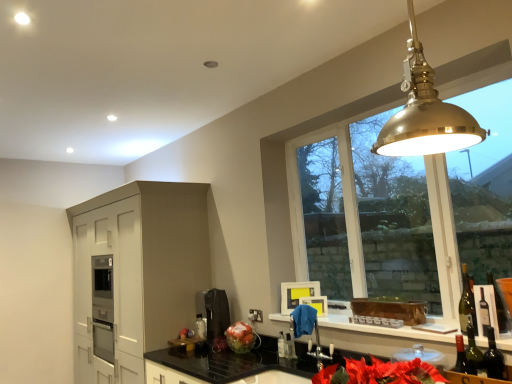
This screenshot has height=384, width=512. Describe the element at coordinates (499, 306) in the screenshot. I see `green glass wine bottle at right, the 2th wine bottle from the back` at that location.

Describe the element at coordinates (342, 179) in the screenshot. I see `clear glass window at upper right` at that location.

Locate an element on the screen. clear glass window at upper right is located at coordinates (342, 179).

The width and height of the screenshot is (512, 384). What are the coordinates of `translucent glass bottle at lower center` in the screenshot? It's located at (289, 346).

Image resolution: width=512 pixels, height=384 pixels. What do you see at coordinates (289, 346) in the screenshot? I see `translucent glass bottle at lower center` at bounding box center [289, 346].

The image size is (512, 384). Describe the element at coordinates (467, 303) in the screenshot. I see `green glass wine bottle at right, arranged as the 3th wine bottle when viewed from the front` at that location.

What is the approximate height of black granite countertop at lower center?

black granite countertop at lower center is 19.05 inches in height.

Image resolution: width=512 pixels, height=384 pixels. Find the location of `green glass wine bottle at right, the 2th wine bottle from the back`. green glass wine bottle at right, the 2th wine bottle from the back is located at coordinates (499, 306).

Between translucent glass bottle at lower center and green glass wine bottle at right, the 2th wine bottle from the back, which one has smaller width?

Thinner between the two is translucent glass bottle at lower center.

Is translucent glass bottle at lower center turned away from green glass wine bottle at right, the 2th wine bottle from the back?

No, green glass wine bottle at right, the 2th wine bottle from the back, is not at the back of translucent glass bottle at lower center.

Is green glass wine bottle at right, the 2th wine bottle from the back, inside translucent glass bottle at lower center?

No.

Which is behind, translucent glass bottle at lower center or green glass wine bottle at right, positioned as the 2th wine bottle in front-to-back order?

translucent glass bottle at lower center is further from the camera.

From the metallic silver faucet at lower center, count 3rd wine bottle to the right and point to it. Please provide its 2D coordinates.

[(499, 306)]

From the image's perspective, does metallic silver faucet at lower center appear lower than green glass wine bottle at right, positioned as the 2th wine bottle in front-to-back order?

Indeed, from the image's perspective, metallic silver faucet at lower center is shown beneath green glass wine bottle at right, positioned as the 2th wine bottle in front-to-back order.

Which of these two, metallic silver faucet at lower center or green glass wine bottle at right, the 2th wine bottle from the back, stands shorter?

Standing shorter between the two is green glass wine bottle at right, the 2th wine bottle from the back.

In the image, is metallic silver faucet at lower center positioned in front of or behind green glass wine bottle at right, the 2th wine bottle from the back?

metallic silver faucet at lower center is positioned farther from the viewer than green glass wine bottle at right, the 2th wine bottle from the back.

Considering the points (223, 322) and (443, 75), which point is in front, point (223, 322) or point (443, 75)?

The point (443, 75) is in front.

Is black matte coffee machine at center turned away from clear glass window at upper right?

No, black matte coffee machine at center's orientation is not away from clear glass window at upper right.

From a real-world perspective, between black matte coffee machine at center and clear glass window at upper right, who is vertically lower?

black matte coffee machine at center is physically lower.

Which of these two, black matte coffee machine at center or clear glass window at upper right, is bigger?

Bigger between the two is clear glass window at upper right.

Does clear glass window at upper right have a lesser height compared to metallic silver faucet at lower center?

No, clear glass window at upper right is not shorter than metallic silver faucet at lower center.

Which is farther from the camera, (466, 78) or (308, 354)?

The point (308, 354) is more distant.

Does clear glass window at upper right turn towards metallic silver faucet at lower center?

Yes, clear glass window at upper right is aimed at metallic silver faucet at lower center.

In the scene shown: Between clear glass window at upper right and metallic silver faucet at lower center, which one is positioned in front?

clear glass window at upper right is in front.

Is clear glass window at upper right directly adjacent to brass pendant light at upper right?

No, clear glass window at upper right is not next to brass pendant light at upper right.

Which object is positioned more to the left, clear glass window at upper right or brass pendant light at upper right?

From the viewer's perspective, brass pendant light at upper right appears more on the left side.

Is green glass wine bottle at right, positioned as the 2th wine bottle in front-to-back order, far from matte white cabinet at left?

Yes.

Is green glass wine bottle at right, positioned as the 2th wine bottle in front-to-back order, positioned before matte white cabinet at left?

Yes, green glass wine bottle at right, positioned as the 2th wine bottle in front-to-back order, is in front of matte white cabinet at left.

Is green glass wine bottle at right, positioned as the 2th wine bottle in front-to-back order, positioned beyond the bounds of matte white cabinet at left?

Yes, green glass wine bottle at right, positioned as the 2th wine bottle in front-to-back order, is located beyond the bounds of matte white cabinet at left.

Is green glass wine bottle at right, the 2th wine bottle from the back, aimed at matte white cabinet at left?

No, green glass wine bottle at right, the 2th wine bottle from the back, is not facing towards matte white cabinet at left.

From the image's perspective, count 2nd wine bottles downward from the clear glass window at upper right and point to it. Please provide its 2D coordinates.

[(467, 303)]

Does green glass wine bottle at right, arranged as the 3th wine bottle when viewed from the front, appear on the left side of clear glass window at upper right?

In fact, green glass wine bottle at right, arranged as the 3th wine bottle when viewed from the front, is to the right of clear glass window at upper right.

Based on their sizes in the image, would you say green glass wine bottle at right, arranged as the 3th wine bottle when viewed from the front, is bigger or smaller than clear glass window at upper right?

Clearly, green glass wine bottle at right, arranged as the 3th wine bottle when viewed from the front, is smaller in size than clear glass window at upper right.

What are the coordinates of `bottle below the green glass wine bottle at right, the 2th wine bottle from the back (from the image's perspective)` in the screenshot? It's located at (289, 346).

Find the location of a particular element. the 2nd wine bottle in front of the metallic silver faucet at lower center is located at coordinates (499, 306).

From the image, which object appears to be farther from matte white cabinet at left, black granite countertop at lower center or brass pendant light at upper right?

brass pendant light at upper right is positioned further to the anchor matte white cabinet at left.

In the scene shown: Which object lies nearer to the anchor point green glass wine bottle at right, the 2th wine bottle from the back, green glass wine bottle at lower right, the first wine bottle in the front-to-back sequence, or green glass wine bottle at right, arranged as the 3th wine bottle when viewed from the front?

Based on the image, green glass wine bottle at lower right, the first wine bottle in the front-to-back sequence, appears to be nearer to green glass wine bottle at right, the 2th wine bottle from the back.

Based on their spatial positions, is black matte coffee machine at center or green glass wine bottle at lower right, the first wine bottle in the front-to-back sequence, further from white glossy window sill at lower center?

Among the two, black matte coffee machine at center is located further to white glossy window sill at lower center.

Which object lies nearer to the anchor point translucent glass bottle at lower center, white glossy window sill at lower center or green glass wine bottle at right, the 2th wine bottle from the back?

Based on the image, white glossy window sill at lower center appears to be nearer to translucent glass bottle at lower center.

From the image, which object appears to be nearer to green glass wine bottle at right, acting as the first wine bottle starting from the back, white glossy window sill at lower center or translucent glass bottle at lower center?

white glossy window sill at lower center lies closer to green glass wine bottle at right, acting as the first wine bottle starting from the back, than the other object.

From the image, which object appears to be farther from metallic silver faucet at lower center, translucent glass bottle at lower center or matte white cabinet at left?

Based on the image, matte white cabinet at left appears to be further to metallic silver faucet at lower center.

Looking at the image, which one is located further to metallic silver faucet at lower center, translucent glass bottle at lower center or brass pendant light at upper right?

The object further to metallic silver faucet at lower center is brass pendant light at upper right.

Looking at the image, which one is located closer to translucent glass bottle at lower center, green glass wine bottle at right, arranged as the 3th wine bottle when viewed from the front, or brass pendant light at upper right?

Based on the image, green glass wine bottle at right, arranged as the 3th wine bottle when viewed from the front, appears to be nearer to translucent glass bottle at lower center.

Where is `window between green glass wine bottle at right, the 2th wine bottle from the back, and black matte coffee machine at center, along the z-axis`? This screenshot has width=512, height=384. window between green glass wine bottle at right, the 2th wine bottle from the back, and black matte coffee machine at center, along the z-axis is located at coordinates (342, 179).

Identify the location of bottle between white glossy window sill at lower center and black matte coffee machine at center along the z-axis. Image resolution: width=512 pixels, height=384 pixels. (289, 346).

You are a GUI agent. You are given a task and a screenshot of the screen. Output one action in this format:
    pyautogui.click(x=<x>, y=<y>)
    Task: Click on the bottle located between metallic silver faucet at lower center and black matte coffee machine at center in the depth direction
    The width and height of the screenshot is (512, 384).
    Given the screenshot: What is the action you would take?
    pyautogui.click(x=289, y=346)

Identify the location of faucet between black granite countertop at lower center and black matte coffee machine at center along the z-axis. The image size is (512, 384). (309, 331).